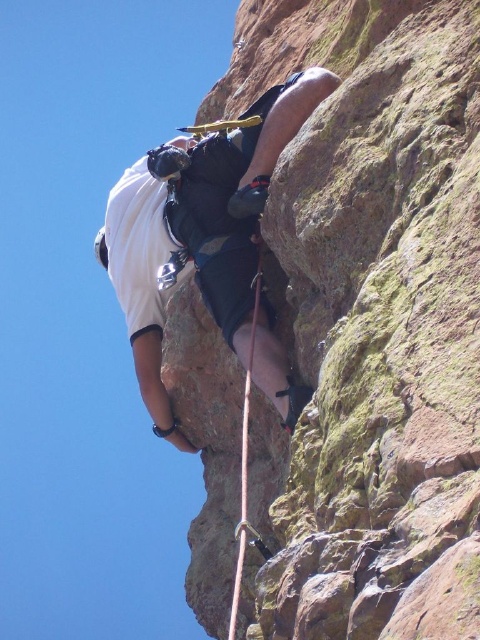
Question: Can you confirm if rusty rock at center is bigger than white matte climbing harness at center?

Choices:
 (A) yes
 (B) no

Answer: (A)

Question: Which of the following is the farthest from the observer?

Choices:
 (A) (171, 440)
 (B) (373, 572)

Answer: (A)

Question: Can you confirm if rusty rock at center is wider than orange nylon rope at center?

Choices:
 (A) yes
 (B) no

Answer: (A)

Question: Which object is positioned farthest from the orange nylon rope at center?

Choices:
 (A) white matte climbing harness at center
 (B) rusty rock at center

Answer: (B)

Question: Does white matte climbing harness at center appear on the left side of orange nylon rope at center?

Choices:
 (A) yes
 (B) no

Answer: (A)

Question: Estimate the real-world distances between objects in this image. Which object is farther from the white matte climbing harness at center?

Choices:
 (A) rusty rock at center
 (B) orange nylon rope at center

Answer: (B)